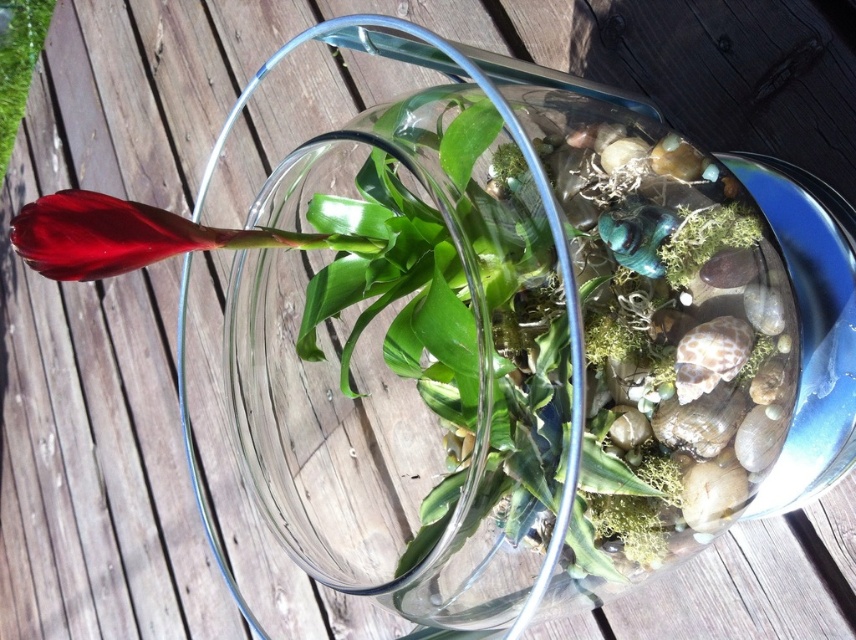
Question: Does glossy red flower at left come behind matte green leaf at upper left?

Choices:
 (A) no
 (B) yes

Answer: (A)

Question: Considering the relative positions of glossy red flower at left and matte green leaf at upper left in the image provided, where is glossy red flower at left located with respect to matte green leaf at upper left?

Choices:
 (A) left
 (B) right

Answer: (B)

Question: Can you confirm if glossy red flower at left is positioned below matte green leaf at upper left?

Choices:
 (A) yes
 (B) no

Answer: (A)

Question: Among these points, which one is farthest from the camera?

Choices:
 (A) (48, 22)
 (B) (143, 236)

Answer: (A)

Question: Which point is farther to the camera?

Choices:
 (A) glossy red flower at left
 (B) matte green leaf at upper left

Answer: (B)